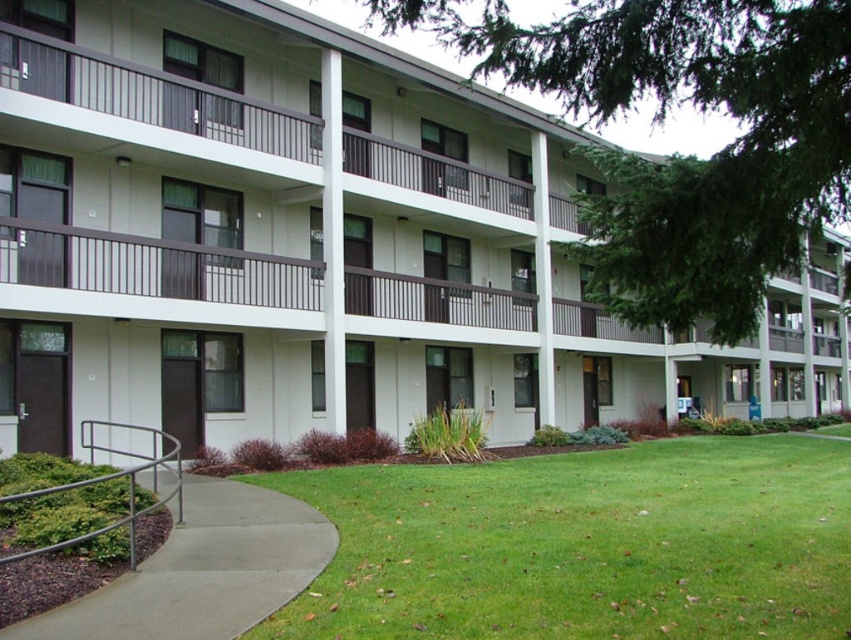
Question: Does white matte building at center have a larger size compared to concrete at lower left?

Choices:
 (A) yes
 (B) no

Answer: (A)

Question: Observing the image, what is the correct spatial positioning of green leafy tree at center in reference to concrete at lower left?

Choices:
 (A) right
 (B) left

Answer: (A)

Question: Which is farther from the green grass at lower center?

Choices:
 (A) green leafy tree at center
 (B) concrete at lower left
 (C) white matte building at center

Answer: (C)

Question: Is white matte building at center thinner than green leafy tree at center?

Choices:
 (A) yes
 (B) no

Answer: (B)

Question: Which object is the farthest from the concrete at lower left?

Choices:
 (A) green grass at lower center
 (B) white matte building at center
 (C) green leafy tree at center

Answer: (B)

Question: Which object appears farthest from the camera in this image?

Choices:
 (A) green grass at lower center
 (B) concrete at lower left

Answer: (B)